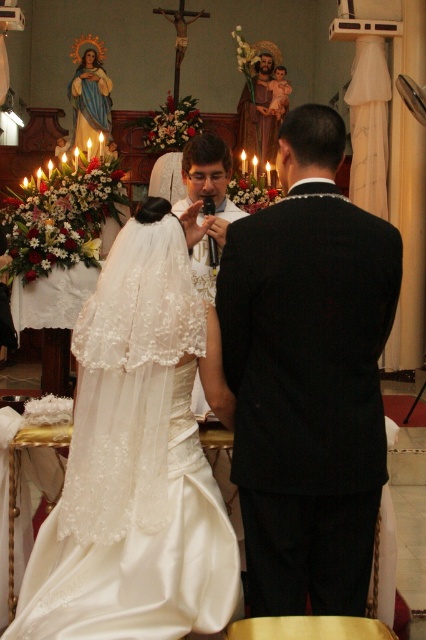
In the scene shown: You are a photographer at the wedding ceremony. You need to capture a photo that includes both the bride and groom. The bride is standing at point (218,172) and the groom is at point (108,81). From your current position, which direction should you move to ensure both are in frame?

To include both the bride at point (218,172) and the groom at point (108,81) in the photo, you should move towards the direction of the groom since the bride is in front of the groom. This adjustment will allow both subjects to be visible within the frame.